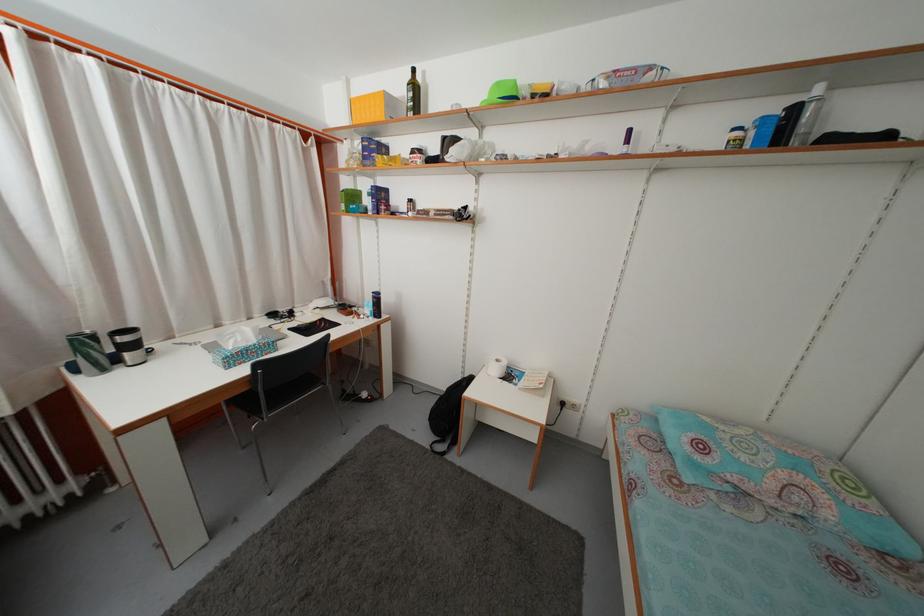
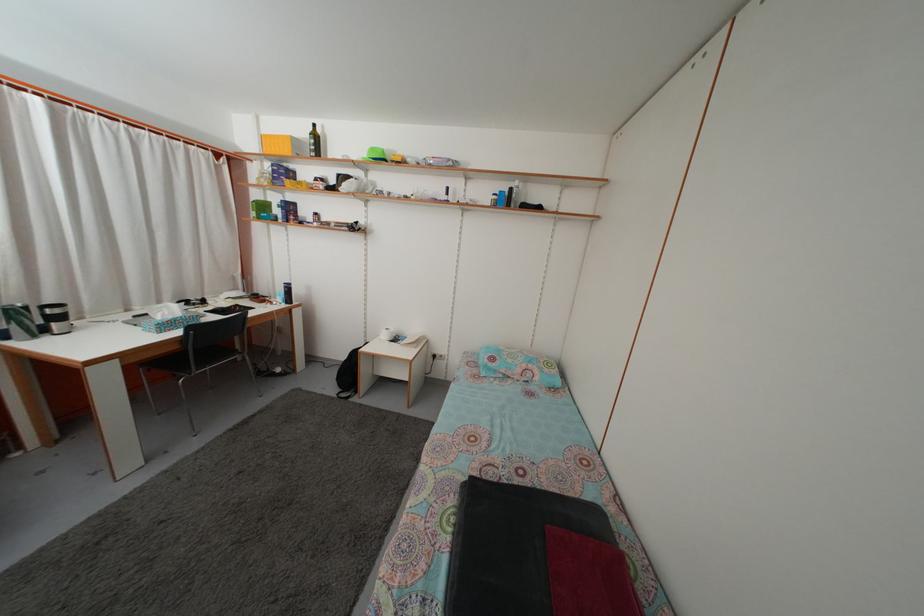
Question: The first image is from the beginning of the video and the second image is from the end. How did the camera likely rotate when shooting the video?

Choices:
 (A) Left
 (B) Right
 (C) Up
 (D) Down

Answer: (B)